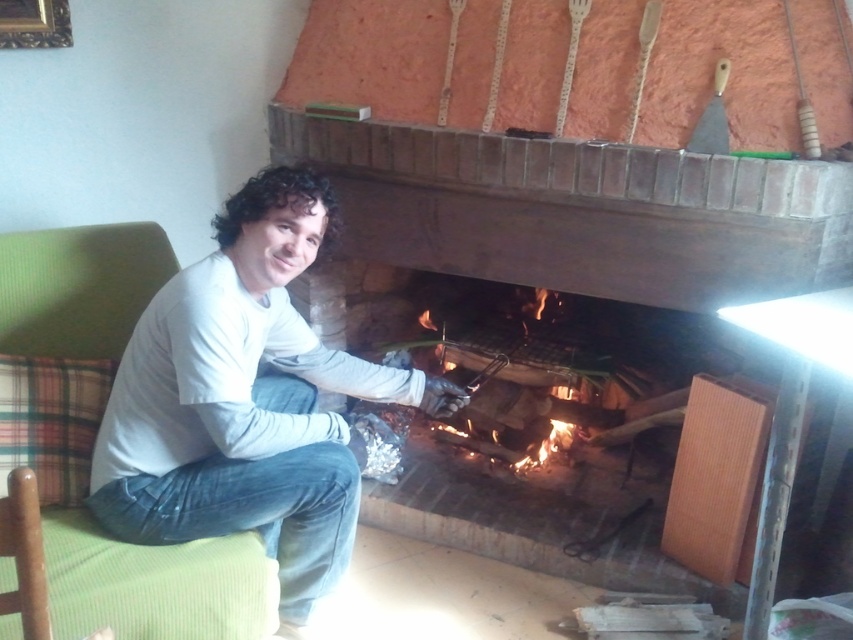
Question: Does white matte shirt at center have a larger size compared to green fabric armchair at left?

Choices:
 (A) no
 (B) yes

Answer: (B)

Question: Which point appears closest to the camera in this image?

Choices:
 (A) (77, 324)
 (B) (167, 497)

Answer: (B)

Question: Is white matte shirt at center wider than green fabric armchair at left?

Choices:
 (A) no
 (B) yes

Answer: (B)

Question: Is white matte shirt at center wider than green fabric armchair at left?

Choices:
 (A) yes
 (B) no

Answer: (A)